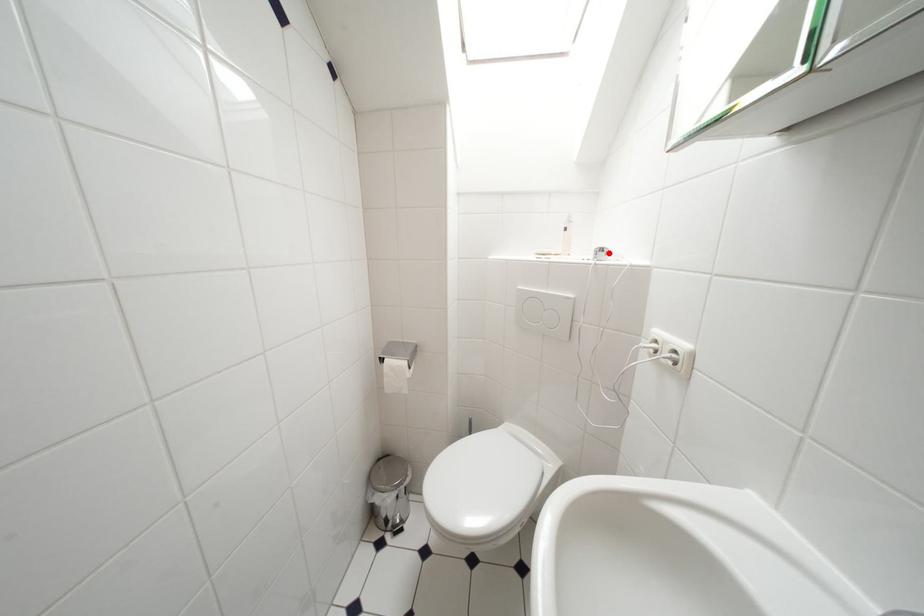
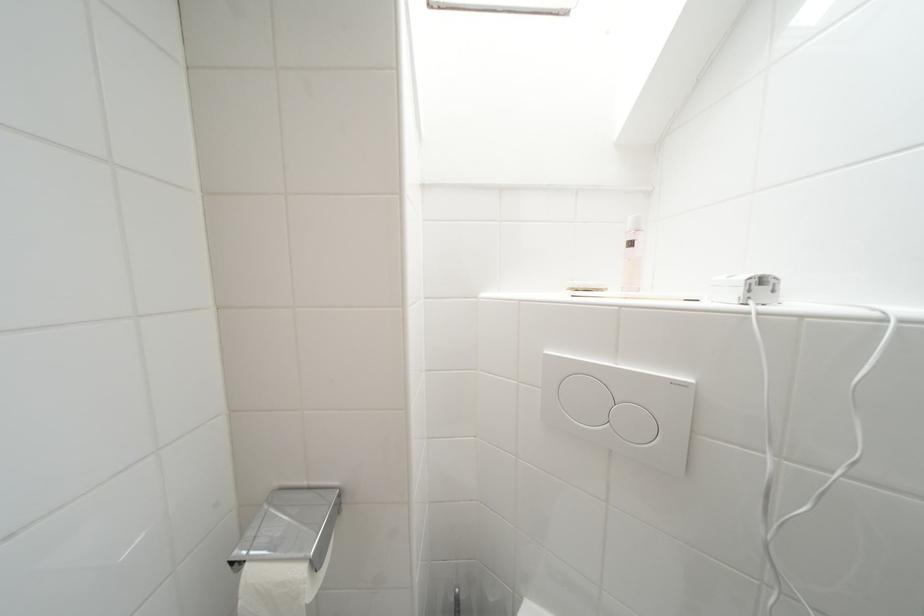
Question: I am providing you with two images of the same scene from different viewpoints. A red point is marked on the first image. At the location where the point appears in image 1, is it still visible in image 2?

Choices:
 (A) Yes
 (B) No

Answer: (A)